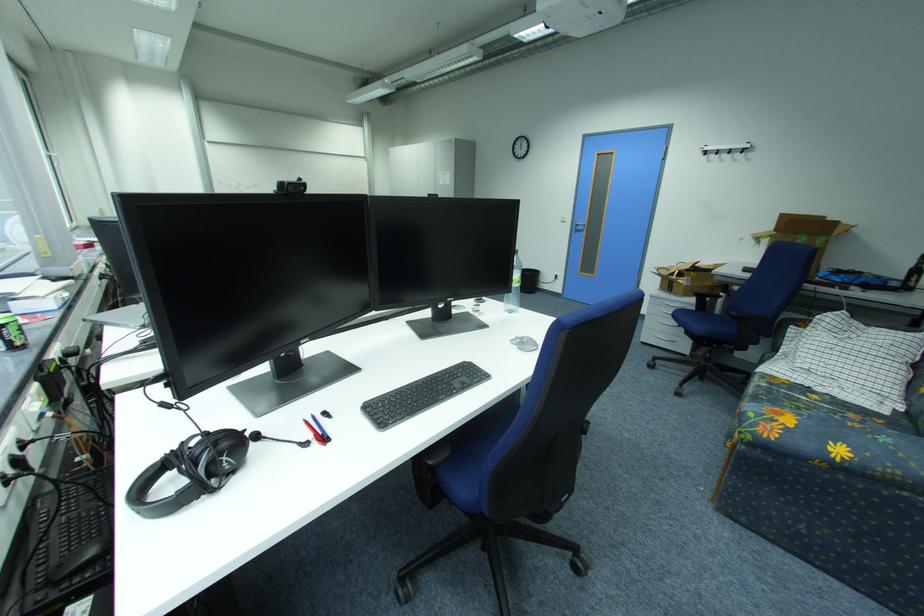
Find the location of a particular element. Image resolution: width=924 pixels, height=616 pixels. sofa sitting surface is located at coordinates (823, 405).